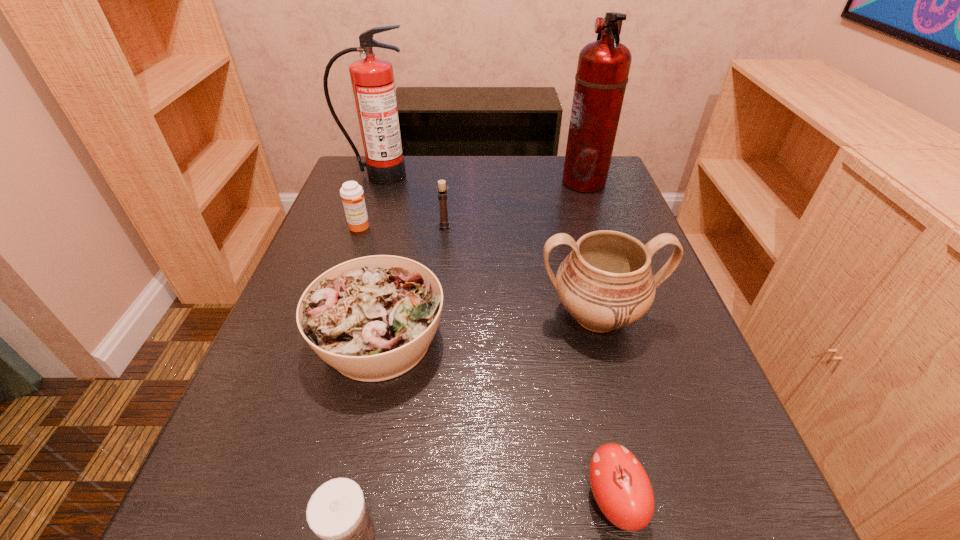
The width and height of the screenshot is (960, 540). In order to click on object present at the far right corner in this screenshot , I will do `click(603, 67)`.

Locate an element on the screen. blank space at the far edge of the desktop is located at coordinates [x=470, y=188].

This screenshot has height=540, width=960. Identify the location of free location at the near edge of the desktop. (494, 501).

The width and height of the screenshot is (960, 540). I want to click on free location at the left edge, so click(332, 372).

You are a GUI agent. You are given a task and a screenshot of the screen. Output one action in this format:
    pyautogui.click(x=<x>, y=<y>)
    Task: Click on the vacant position at the right edge of the desktop
    This screenshot has height=540, width=960.
    Given the screenshot: What is the action you would take?
    pyautogui.click(x=625, y=390)

The image size is (960, 540). In the image, there is a desktop. In order to click on free space at the near left corner in this screenshot , I will do `click(304, 523)`.

Image resolution: width=960 pixels, height=540 pixels. I want to click on vacant space at the far right corner, so click(592, 198).

Locate an element on the screen. The width and height of the screenshot is (960, 540). vacant space at the near right corner of the desktop is located at coordinates (658, 511).

Identify the location of vacant area that lies between the right fire extinguisher and the salad. (482, 261).

Locate an element on the screen. This screenshot has height=540, width=960. empty location between the right fire extinguisher and the candle holder is located at coordinates (514, 204).